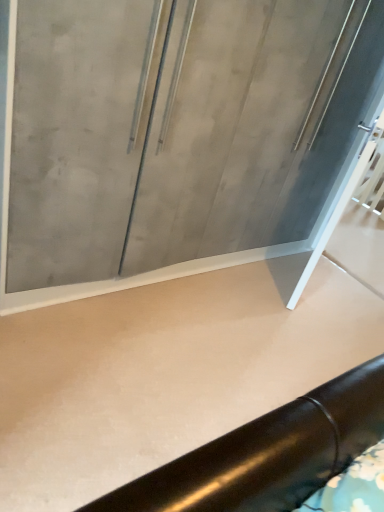
At what (x,y) coordinates should I click in order to perform the action: click on empty space that is ontop of smooth concrete at center (from a real-world perspective). Please return your answer as a coordinate pair (x, y). The height and width of the screenshot is (512, 384). Looking at the image, I should click on (181, 356).